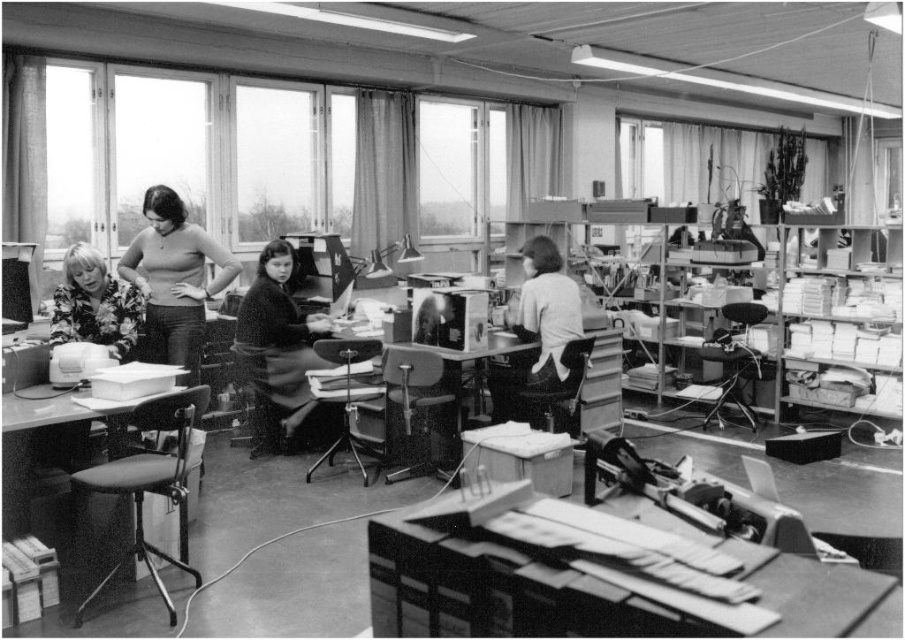
Can you confirm if matte black sweater at center is positioned above light gray fabric shirt at center?

Indeed, matte black sweater at center is positioned over light gray fabric shirt at center.

Consider the image. Can you confirm if matte black sweater at center is shorter than light gray fabric shirt at center?

Incorrect, matte black sweater at center's height does not fall short of light gray fabric shirt at center's.

Does point (189, 291) come in front of point (579, 301)?

Yes, it is in front of point (579, 301).

The image size is (905, 640). I want to click on matte black sweater at center, so click(174, 278).

Does dark fabric coat at center have a larger size compared to matte black sweater at center?

No.

Measure the distance between dark fabric coat at center and matte black sweater at center.

dark fabric coat at center and matte black sweater at center are 18.10 inches apart from each other.

Describe the element at coordinates (280, 356) in the screenshot. The width and height of the screenshot is (905, 640). I see `dark fabric coat at center` at that location.

You are a GUI agent. You are given a task and a screenshot of the screen. Output one action in this format:
    pyautogui.click(x=<x>, y=<y>)
    Task: Click on the dark fabric coat at center
    
    Given the screenshot: What is the action you would take?
    pyautogui.click(x=280, y=356)

Who is more forward, (548, 289) or (92, 320)?

Point (92, 320)

Does light gray fabric shirt at center appear over floral fabric blouse at left?

Incorrect, light gray fabric shirt at center is not positioned above floral fabric blouse at left.

Who is more distant from viewer, (532, 310) or (60, 337)?

Point (532, 310)

What are the coordinates of `light gray fabric shirt at center` in the screenshot? It's located at (546, 314).